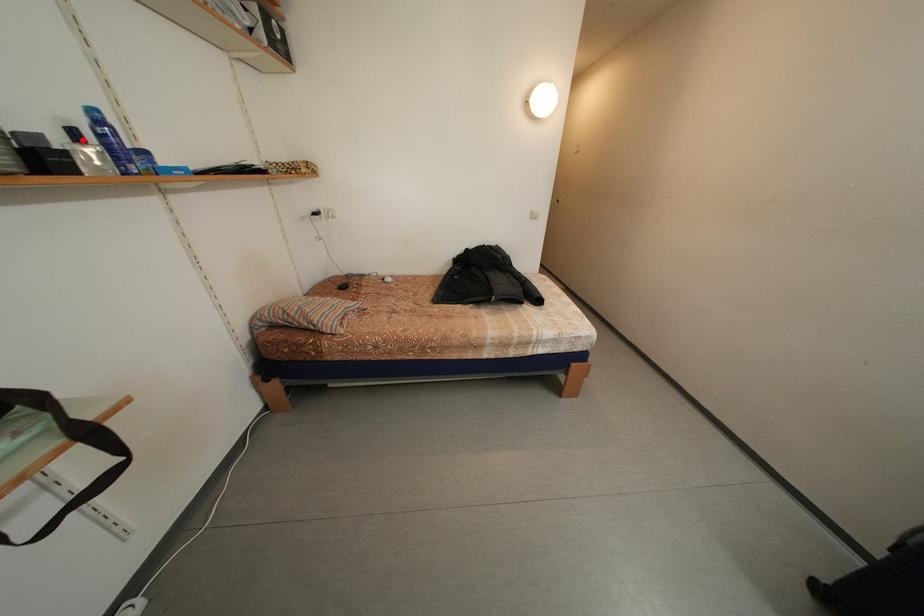
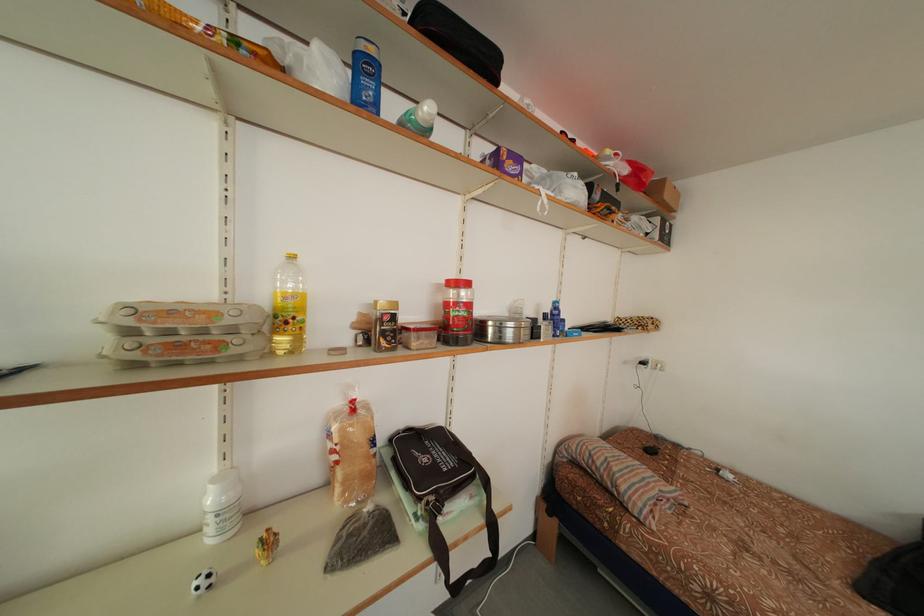
In the second image, find the point that corresponds to the highlighted location in the first image.

(553, 322)